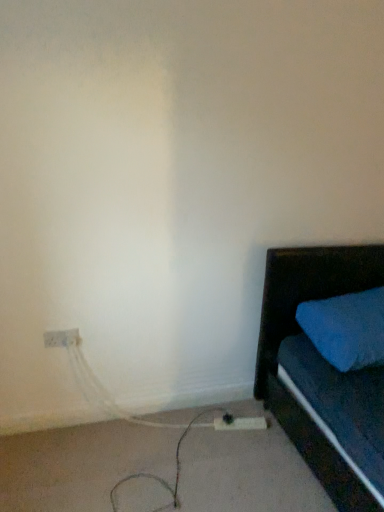
Locate an element on the screen. vacant area that is in front of white plastic extension cord at lower center is located at coordinates pyautogui.click(x=234, y=446).